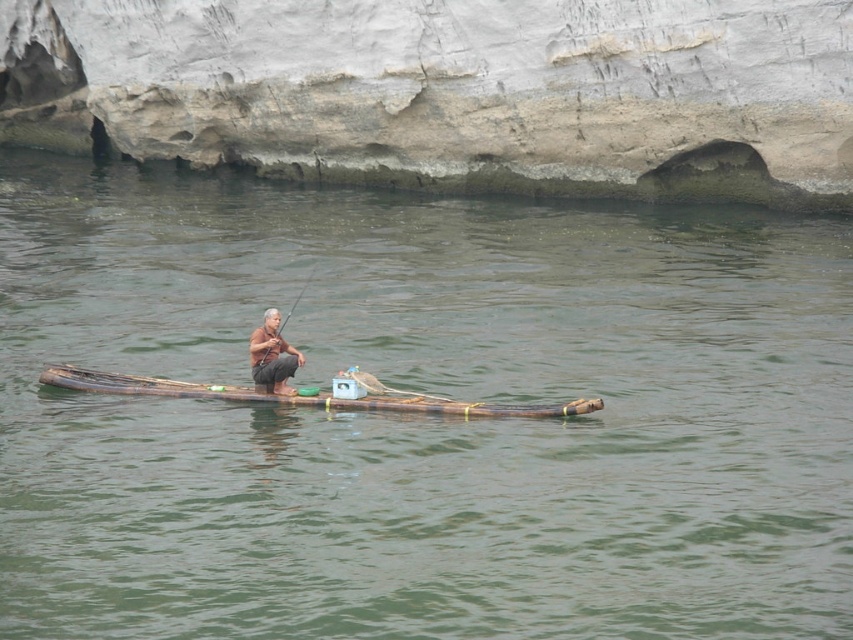
Find the location of a particular element. Image resolution: width=853 pixels, height=640 pixels. brown wood boat at center is located at coordinates (303, 396).

Is brown wood boat at center wider than wooden textured paddle at center?

Incorrect, brown wood boat at center's width does not surpass wooden textured paddle at center's.

What are the coordinates of `brown wood boat at center` in the screenshot? It's located at (303, 396).

At what (x,y) coordinates should I click in order to perform the action: click on brown wood boat at center. Please return your answer as a coordinate pair (x, y). Looking at the image, I should click on (303, 396).

Which of these two, brown wood boat at center or brown matte fisherman at center, stands taller?

With more height is brown matte fisherman at center.

Which is more to the right, brown wood boat at center or brown matte fisherman at center?

brown matte fisherman at center

Which is behind, point (564, 413) or point (259, 378)?

The point (259, 378) is behind.

The width and height of the screenshot is (853, 640). What are the coordinates of `brown wood boat at center` in the screenshot? It's located at (303, 396).

Who is more distant from viewer, (291, 369) or (299, 296)?

Positioned behind is point (299, 296).

Locate an element on the screen. Image resolution: width=853 pixels, height=640 pixels. brown matte fisherman at center is located at coordinates (271, 355).